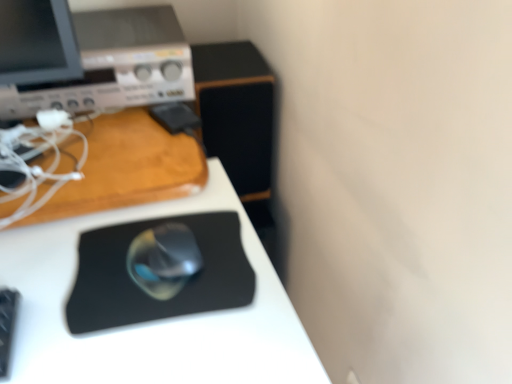
I want to click on vacant space in front of satin silver mouse at center, so click(152, 341).